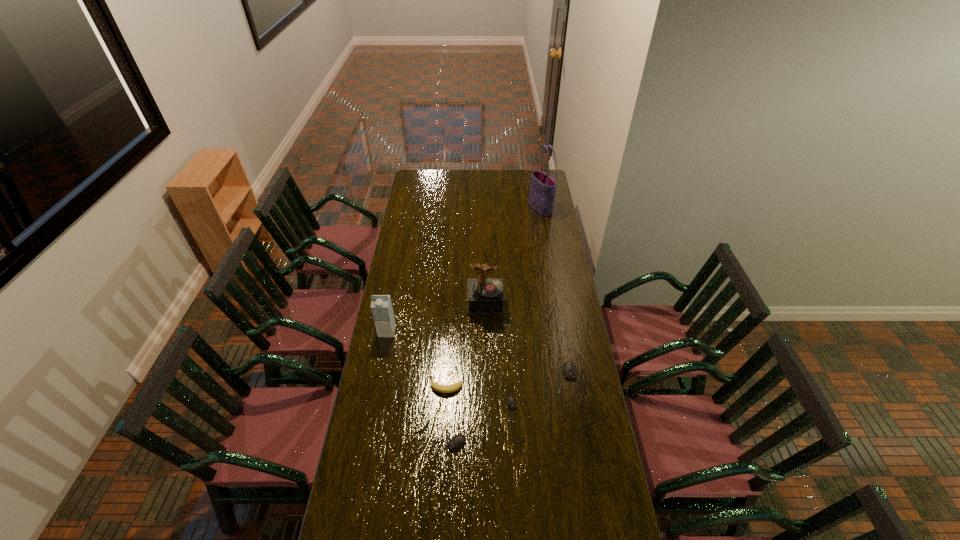
This screenshot has height=540, width=960. I want to click on the closest mouse to the fifth nearest object, so click(456, 441).

You are a GUI agent. You are given a task and a screenshot of the screen. Output one action in this format:
    pyautogui.click(x=<x>, y=<y>)
    Task: Click on the mouse that is the second nearest to the second farthest mouse
    The width and height of the screenshot is (960, 540).
    Given the screenshot: What is the action you would take?
    pyautogui.click(x=569, y=371)

Where is `free space that satisfies the following two spatial constraints: 1. on the front label of the leftmost object; 2. on the right side of the nearest mouse`? The width and height of the screenshot is (960, 540). free space that satisfies the following two spatial constraints: 1. on the front label of the leftmost object; 2. on the right side of the nearest mouse is located at coordinates (365, 444).

Find the location of `free location that satisfies the following two spatial constraints: 1. at the horn opening of the sixth shortest object; 2. on the right side of the tallest mouse`. free location that satisfies the following two spatial constraints: 1. at the horn opening of the sixth shortest object; 2. on the right side of the tallest mouse is located at coordinates (487, 377).

The width and height of the screenshot is (960, 540). In order to click on free space that satisfies the following two spatial constraints: 1. on the front label of the fifth shortest object; 2. on the right side of the nearest mouse in this screenshot , I will do `click(365, 444)`.

This screenshot has width=960, height=540. Identify the location of vacant space that satisfies the following two spatial constraints: 1. on the front label of the nearest mouse; 2. on the left side of the leftmost object. (365, 444).

Locate an element on the screen. vacant position in the image that satisfies the following two spatial constraints: 1. on the back side of the nearest object; 2. on the right side of the farthest object is located at coordinates (461, 209).